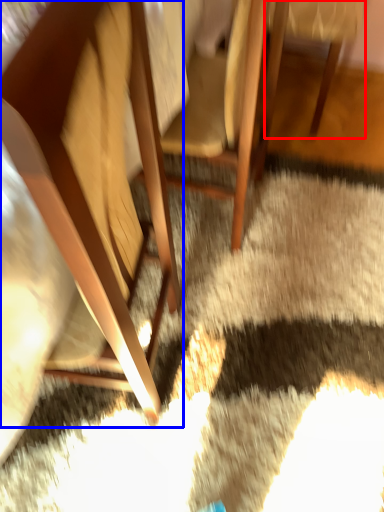
Question: Which object is further to the camera taking this photo, chair (highlighted by a red box) or chair (highlighted by a blue box)?

Choices:
 (A) chair
 (B) chair

Answer: (A)